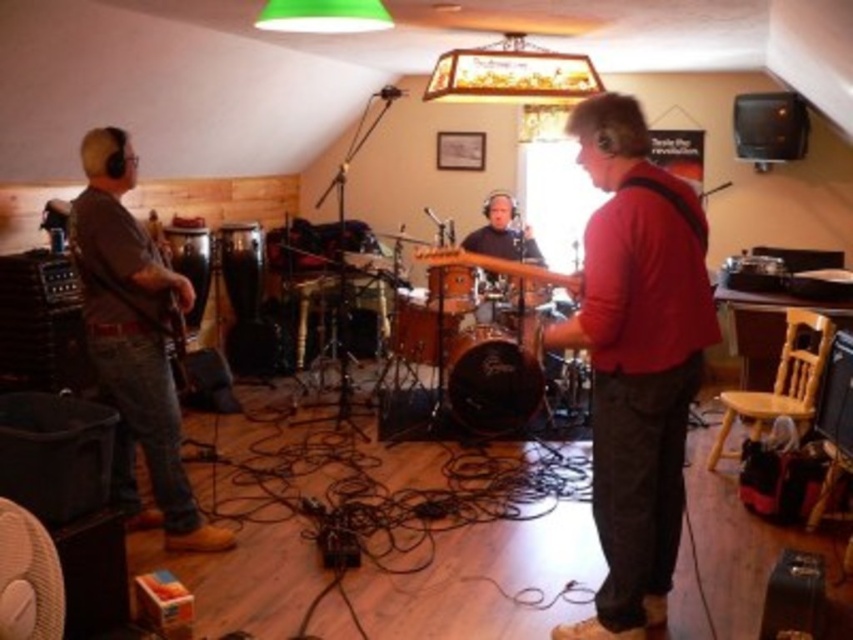
You are a photographer setting up a shoot in the room described. You want to place a spotlight on the red matte guitar at center without it casting a shadow on the wooden drum at center. Based on their positions, is this possible?

The red matte guitar at center is in front of the wooden drum at center, so placing a spotlight directly behind the guitar would cast a shadow on the drum. To avoid this, position the spotlight to the side of the guitar so the light comes from an angle, preventing the shadow from falling on the drum.

You are a technician setting up equipment in the room. You need to place a new speaker that requires a 1 meter clearance from the white fabric fan at lower left. Where should you position the speaker to ensure it is at least 1 meter away from the fan?

The white fabric fan at lower left is located at point [28,577]. To maintain a 1 meter clearance, position the speaker at least 1 meter away from this coordinate in any direction.

You are a photographer setting up a shoot in the music rehearsal room. You need to place a small microphone stand exactly at point (636, 358). What object will the microphone stand be placed on top of?

The microphone stand will be placed on top of the red matte guitar at center located at point (636, 358).